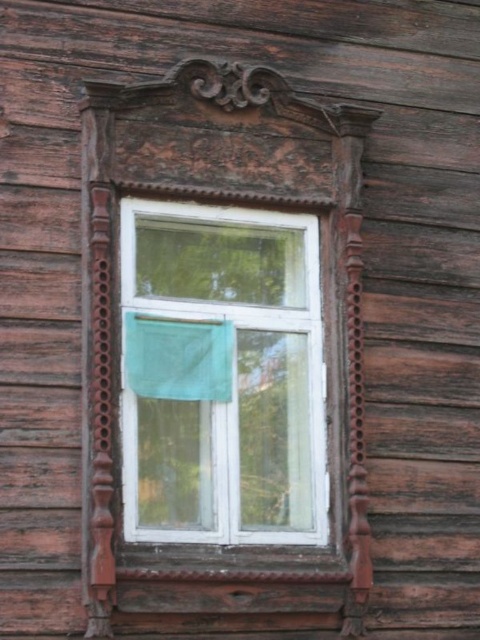
Based on the photo, does white wood window at center appear on the right side of green fabric at center?

Indeed, white wood window at center is positioned on the right side of green fabric at center.

Between white wood window at center and green fabric at center, which one has less height?

green fabric at center

Is point (186, 291) less distant than point (184, 346)?

No, it is not.

The height and width of the screenshot is (640, 480). I want to click on white wood window at center, so click(237, 376).